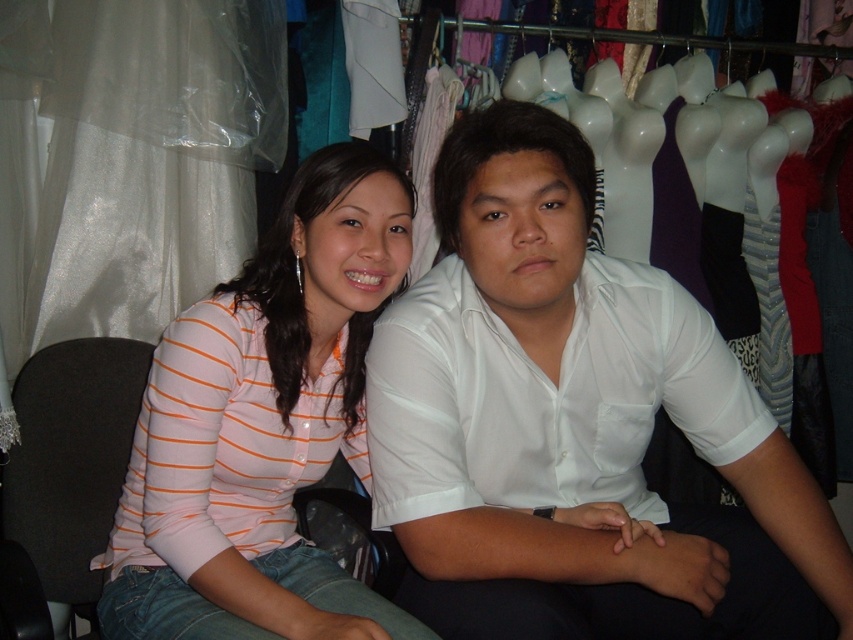
Is white smooth shirt at center closer to camera compared to black fabric chair at left?

Yes.

Is white smooth shirt at center below black fabric chair at left?

Incorrect, white smooth shirt at center is not positioned below black fabric chair at left.

Which is behind, point (637, 355) or point (68, 577)?

Point (68, 577)

Image resolution: width=853 pixels, height=640 pixels. Identify the location of white smooth shirt at center. (575, 426).

Does pink striped shirt at center have a smaller size compared to black fabric chair at left?

Actually, pink striped shirt at center might be larger than black fabric chair at left.

Who is lower down, pink striped shirt at center or black fabric chair at left?

black fabric chair at left

Describe the element at coordinates (262, 426) in the screenshot. I see `pink striped shirt at center` at that location.

Identify the location of pink striped shirt at center. (262, 426).

How much distance is there between white smooth shirt at center and pink striped shirt at center?

white smooth shirt at center is 21.68 centimeters away from pink striped shirt at center.

Is white smooth shirt at center thinner than pink striped shirt at center?

No, white smooth shirt at center is not thinner than pink striped shirt at center.

The height and width of the screenshot is (640, 853). Identify the location of white smooth shirt at center. (575, 426).

Locate an element on the screen. Image resolution: width=853 pixels, height=640 pixels. white smooth shirt at center is located at coordinates (575, 426).